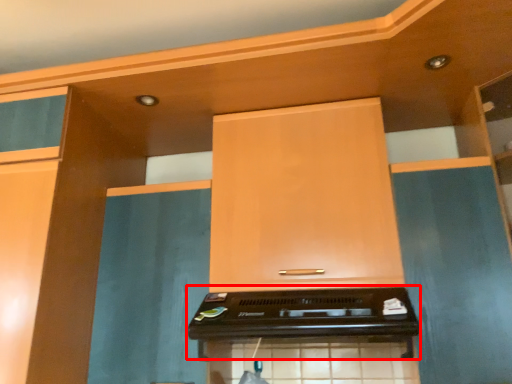
Question: From the image, what is the correct spatial relationship of appliance (annotated by the red box) in relation to cabinetry?

Choices:
 (A) right
 (B) left

Answer: (B)